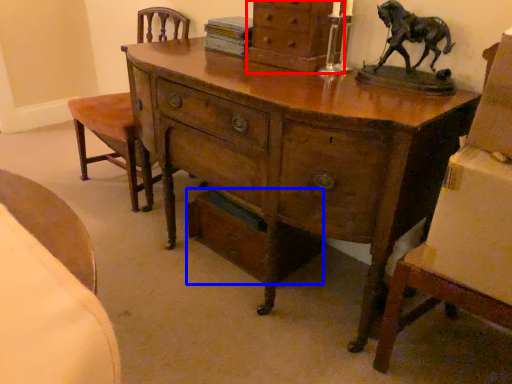
Question: Which object is closer to the camera taking this photo, chest of drawers (highlighted by a red box) or drawer (highlighted by a blue box)?

Choices:
 (A) chest of drawers
 (B) drawer

Answer: (A)